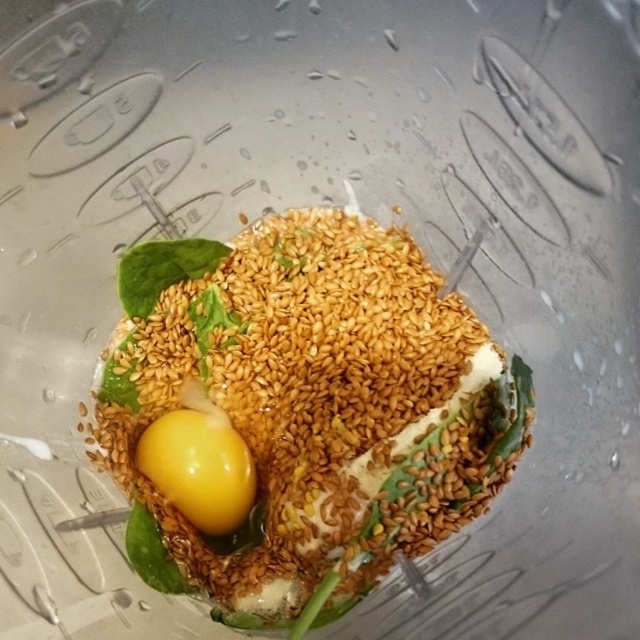
Which is more to the left, yellow egg yolk at center or yellow smooth egg at center?

yellow smooth egg at center is more to the left.

Who is lower down, yellow egg yolk at center or yellow smooth egg at center?

yellow smooth egg at center is lower down.

Is point (518, 378) less distant than point (196, 529)?

Yes.

Image resolution: width=640 pixels, height=640 pixels. I want to click on yellow egg yolk at center, so click(x=308, y=406).